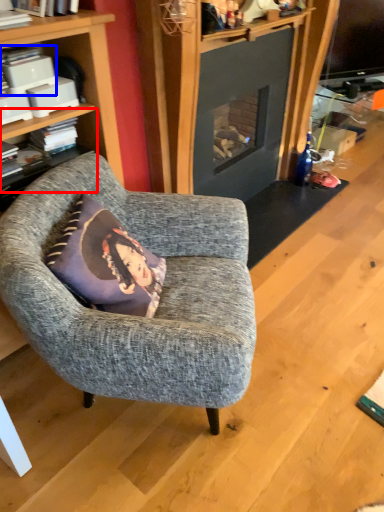
Question: Which object is closer to the camera taking this photo, shelf (highlighted by a red box) or book (highlighted by a blue box)?

Choices:
 (A) shelf
 (B) book

Answer: (B)